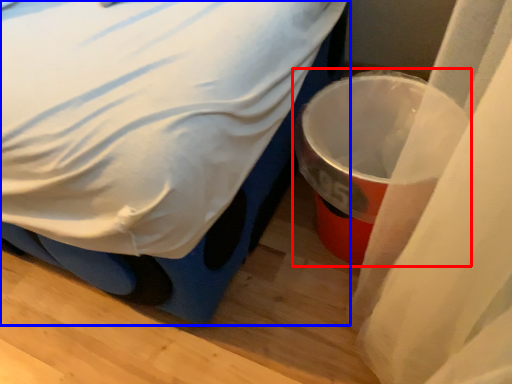
Question: Among these objects, which one is nearest to the camera, waste container (highlighted by a red box) or bed (highlighted by a blue box)?

Choices:
 (A) waste container
 (B) bed

Answer: (B)